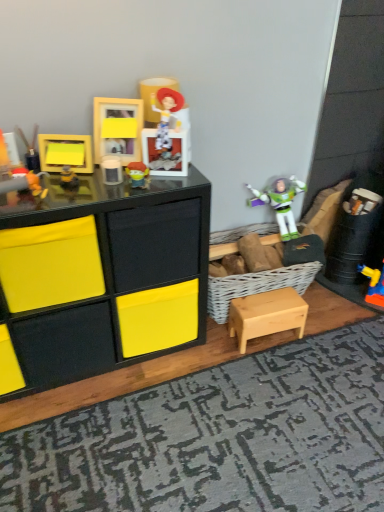
You are a GUI agent. You are given a task and a screenshot of the screen. Output one action in this format:
    pyautogui.click(x=<x>, y=<y>)
    Task: Click on the free point above textured gray rug at lower center (from a real-world perspective)
    
    Given the screenshot: What is the action you would take?
    pyautogui.click(x=260, y=429)